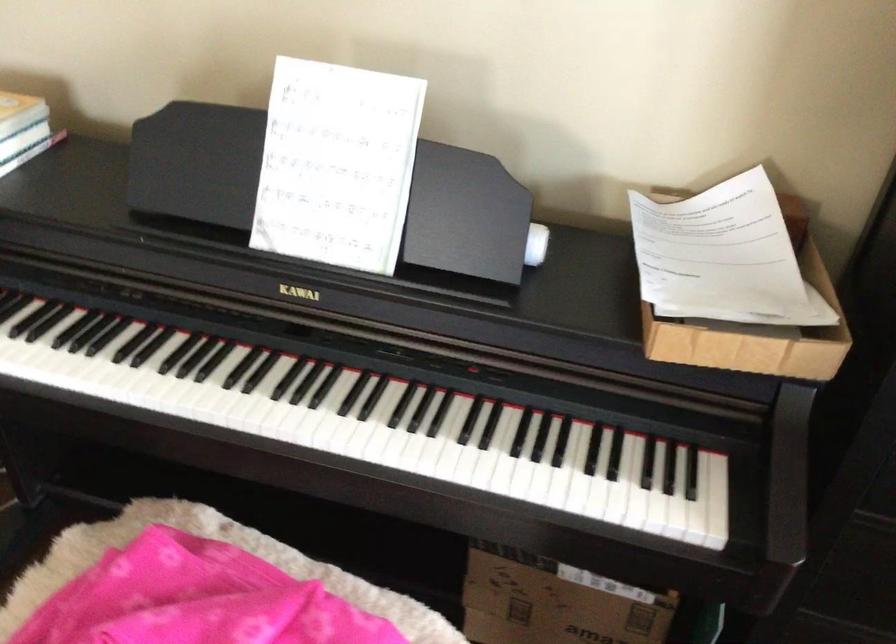
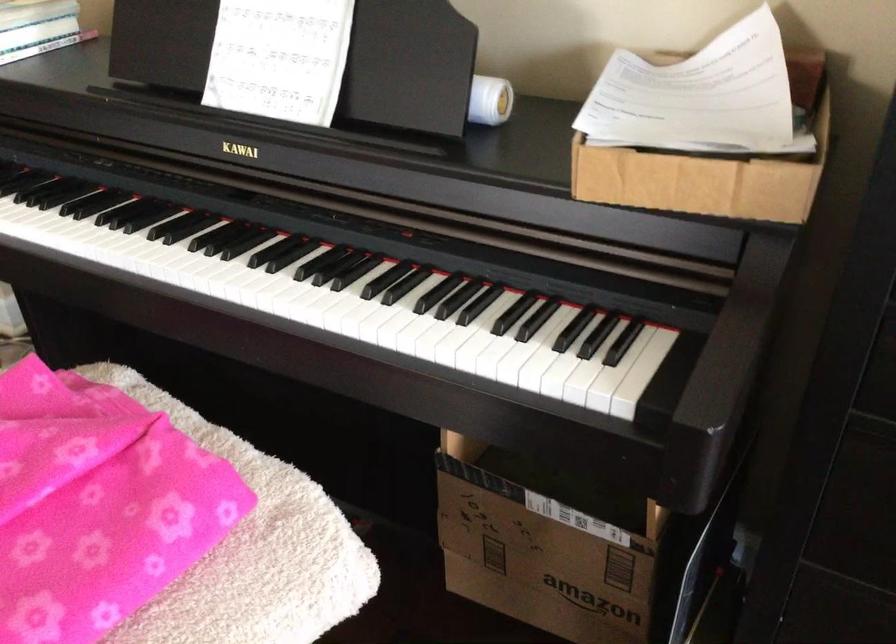
What movement of the cameraman would produce the second image?

The cameraman moved toward right, forward.